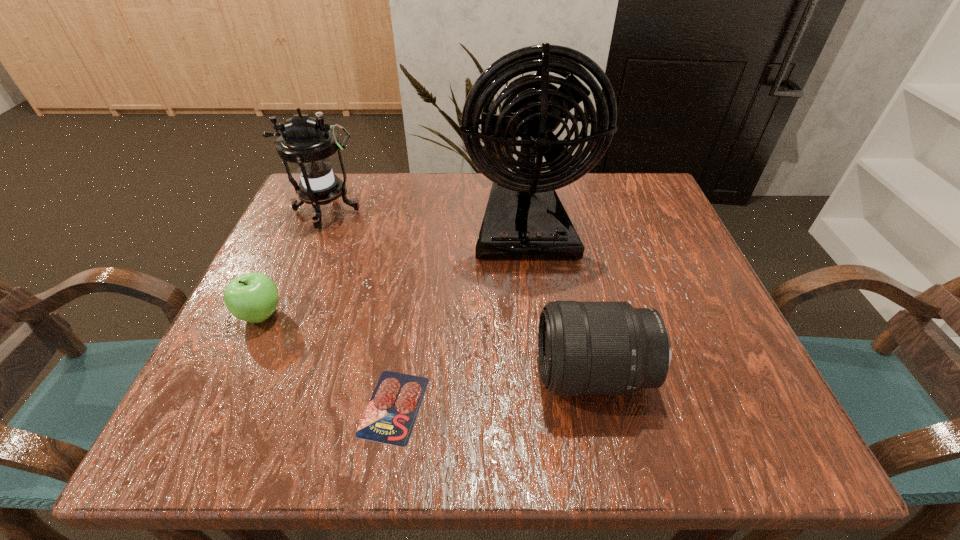
I want to click on object situated at the far left corner, so click(308, 142).

At what (x,y) coordinates should I click in order to perform the action: click on vacant area at the far edge. Please return your answer as a coordinate pair (x, y). Image resolution: width=960 pixels, height=540 pixels. Looking at the image, I should click on (478, 190).

Where is `free space at the near edge of the desktop`? The height and width of the screenshot is (540, 960). free space at the near edge of the desktop is located at coordinates (523, 453).

Where is `vacant position at the left edge of the desktop`? The image size is (960, 540). vacant position at the left edge of the desktop is located at coordinates (269, 328).

Where is `free space at the far left corner`? This screenshot has width=960, height=540. free space at the far left corner is located at coordinates (335, 221).

You are a GUI agent. You are given a task and a screenshot of the screen. Output one action in this format:
    pyautogui.click(x=<x>, y=<y>)
    Task: Click on the free space that is in between the second shortest object and the lantern
    The width and height of the screenshot is (960, 540).
    Given the screenshot: What is the action you would take?
    pyautogui.click(x=294, y=263)

Identify the location of vacant point located between the tallest object and the fourth shortest object. Image resolution: width=960 pixels, height=540 pixels. [425, 219].

What are the coordinates of `vacant space in between the shortest object and the second tallest object` in the screenshot? It's located at (360, 309).

This screenshot has height=540, width=960. I want to click on vacant area between the fourth tallest object and the fan, so click(x=393, y=271).

The width and height of the screenshot is (960, 540). Find the location of `free space between the third nearest object and the tallest object`. free space between the third nearest object and the tallest object is located at coordinates (393, 271).